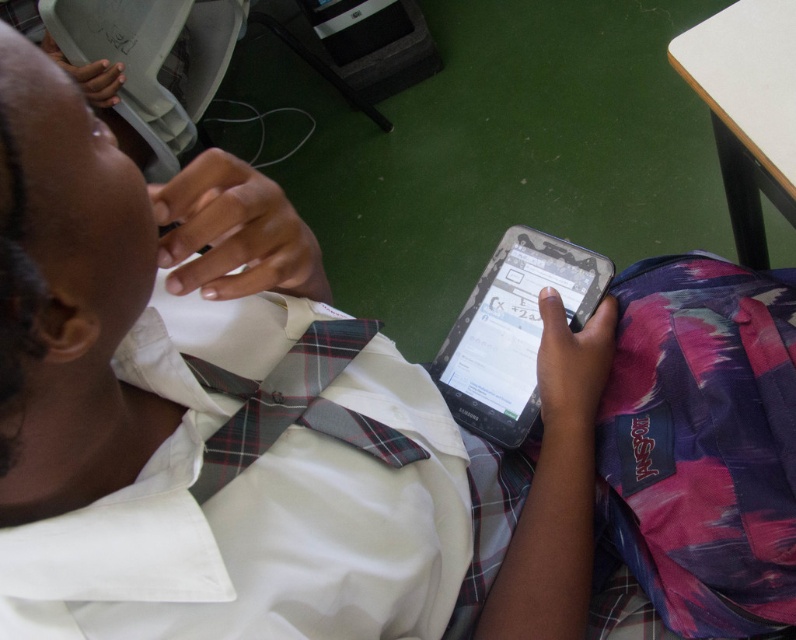
Question: Among these points, which one is farthest from the camera?

Choices:
 (A) (728, 179)
 (B) (342, 426)

Answer: (A)

Question: Which of the following is the closest to the observer?

Choices:
 (A) white plastic table at upper right
 (B) black matte tablet at center
 (C) plaid fabric tie at center

Answer: (C)

Question: Is white plastic table at upper right smaller than black matte tablet at center?

Choices:
 (A) yes
 (B) no

Answer: (B)

Question: Estimate the real-world distances between objects in this image. Which object is farther from the black matte tablet at center?

Choices:
 (A) plaid fabric tie at center
 (B) white plastic table at upper right

Answer: (B)

Question: Can you confirm if white plastic table at upper right is positioned below black matte tablet at center?

Choices:
 (A) no
 (B) yes

Answer: (A)

Question: Can you confirm if white plastic table at upper right is positioned to the right of plaid fabric tie at center?

Choices:
 (A) no
 (B) yes

Answer: (B)